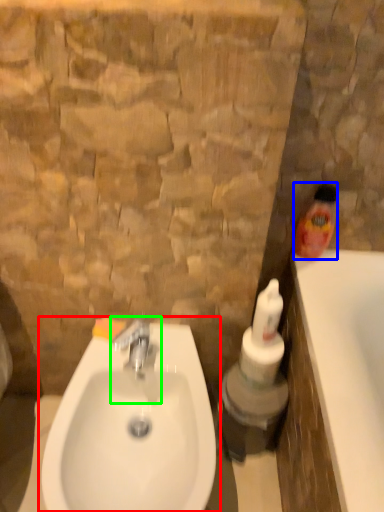
Question: Which is nearer to the sink (highlighted by a red box)? cleaning product (highlighted by a blue box) or tap (highlighted by a green box).

Choices:
 (A) cleaning product
 (B) tap

Answer: (B)